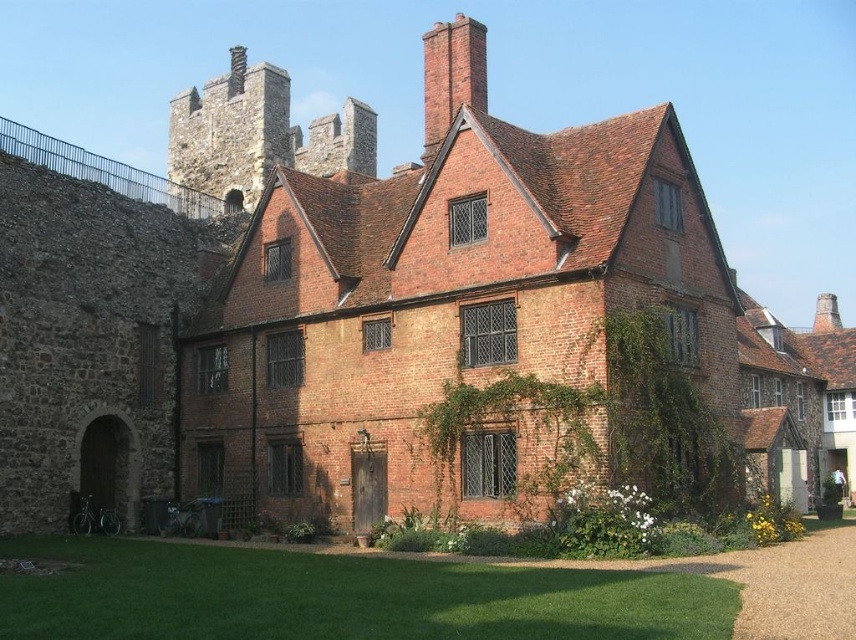
Question: Is green grass at lower center smaller than brick chimney at upper center?

Choices:
 (A) no
 (B) yes

Answer: (B)

Question: Which point appears closest to the camera in this image?

Choices:
 (A) (468, 637)
 (B) (330, 168)

Answer: (A)

Question: Is stone brick tower at upper left to the left of brick chimney at upper center from the viewer's perspective?

Choices:
 (A) yes
 (B) no

Answer: (A)

Question: Which point appears closest to the camera in this image?

Choices:
 (A) [x=438, y=68]
 (B) [x=195, y=616]

Answer: (B)

Question: Which object is the farthest from the brick chimney at upper center?

Choices:
 (A) stone brick tower at upper left
 (B) green grass at lower center

Answer: (A)

Question: Is green grass at lower center behind stone brick tower at upper left?

Choices:
 (A) no
 (B) yes

Answer: (A)